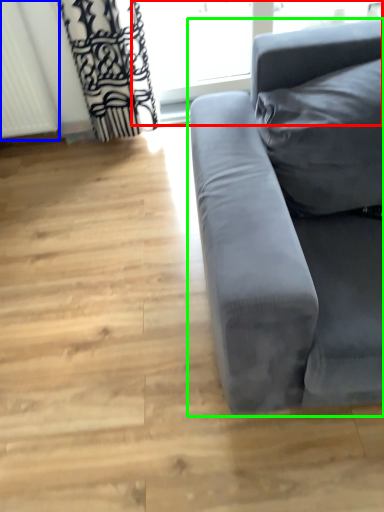
Question: Considering the real-world distances, which object is farthest from window frame (highlighted by a red box)? radiator (highlighted by a blue box) or studio couch (highlighted by a green box)?

Choices:
 (A) radiator
 (B) studio couch

Answer: (B)